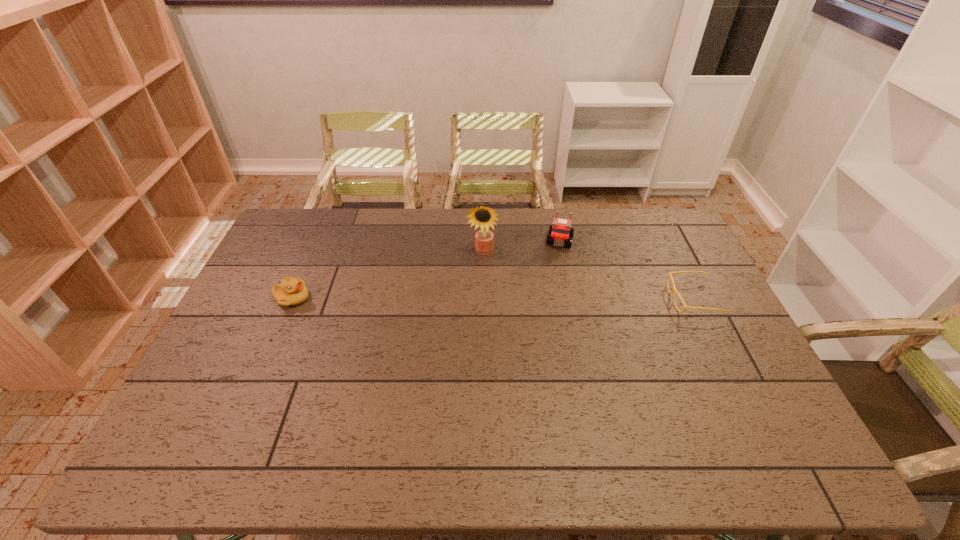
The image size is (960, 540). I want to click on empty space that is in between the third shortest object and the spectacles, so click(627, 270).

You are a GUI agent. You are given a task and a screenshot of the screen. Output one action in this format:
    pyautogui.click(x=<x>, y=<y>)
    Task: Click on the vacant space in between the second shortest object and the Lego
    The height and width of the screenshot is (540, 960).
    Given the screenshot: What is the action you would take?
    pyautogui.click(x=426, y=269)

Locate an element on the screen. The width and height of the screenshot is (960, 540). vacant point located between the tallest object and the duckling is located at coordinates (387, 275).

At what (x,y) coordinates should I click in order to perform the action: click on empty space between the rightmost object and the tallest object. Please return your answer as a coordinate pair (x, y). Image resolution: width=960 pixels, height=540 pixels. Looking at the image, I should click on (588, 275).

The width and height of the screenshot is (960, 540). I want to click on empty space between the shortest object and the third object from right to left, so click(x=588, y=275).

The image size is (960, 540). I want to click on free space between the leftmost object and the second tallest object, so pyautogui.click(x=426, y=269).

Find the location of a particular element. The width and height of the screenshot is (960, 540). free space between the second tallest object and the rightmost object is located at coordinates (627, 270).

At what (x,y) coordinates should I click in order to perform the action: click on free space between the Lego and the shortest object. Please return your answer as a coordinate pair (x, y). This screenshot has width=960, height=540. Looking at the image, I should click on (627, 270).

This screenshot has width=960, height=540. Identify the location of object identified as the closest to the sunflower. (560, 232).

Where is `object that stands as the second closest to the second shortest object`? This screenshot has width=960, height=540. object that stands as the second closest to the second shortest object is located at coordinates (560, 232).